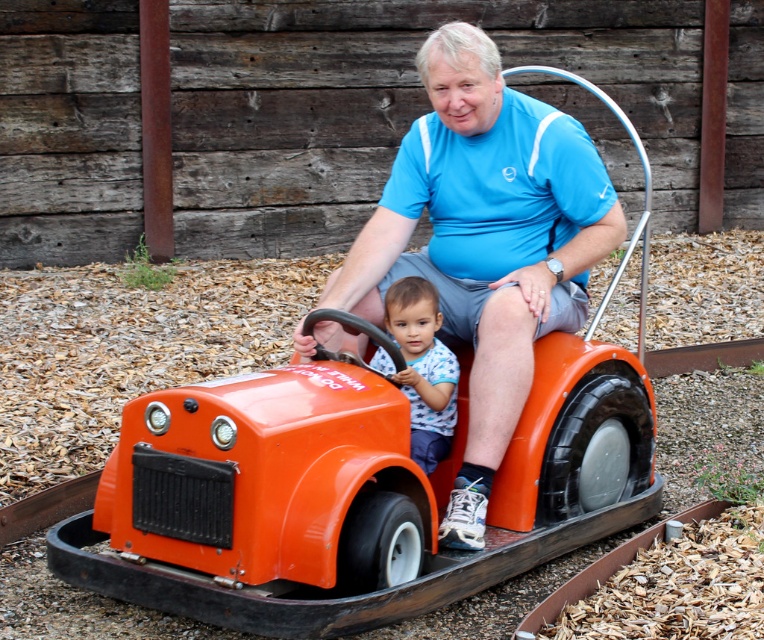
Looking at this image, can you confirm if matte blue shirt at center is positioned above blue dotted shirt at center?

Indeed, matte blue shirt at center is positioned over blue dotted shirt at center.

Where is `matte blue shirt at center`? matte blue shirt at center is located at coordinates (486, 240).

Which is in front, point (312, 314) or point (452, 371)?

Point (312, 314) is in front.

This screenshot has width=764, height=640. Describe the element at coordinates (348, 490) in the screenshot. I see `orange plastic toy car at center` at that location.

Is point (382, 333) closer to camera compared to point (421, 426)?

Yes, point (382, 333) is in front of point (421, 426).

Identify the location of orange plastic toy car at center. Image resolution: width=764 pixels, height=640 pixels. (348, 490).

Can you confirm if orange plastic toy car at center is bigger than matte blue shirt at center?

Yes, orange plastic toy car at center is bigger than matte blue shirt at center.

Based on the photo, does orange plastic toy car at center have a smaller size compared to matte blue shirt at center?

Incorrect, orange plastic toy car at center is not smaller in size than matte blue shirt at center.

Does point (546, 492) lie in front of point (468, 532)?

No, (546, 492) is behind (468, 532).

Identify the location of orange plastic toy car at center. Image resolution: width=764 pixels, height=640 pixels. (348, 490).